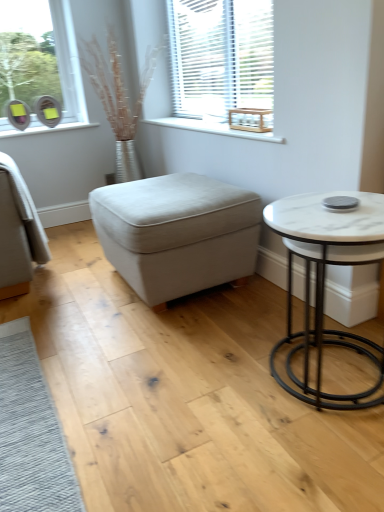
The height and width of the screenshot is (512, 384). I want to click on free space above beige fabric ottoman at center (from a real-world perspective), so click(164, 191).